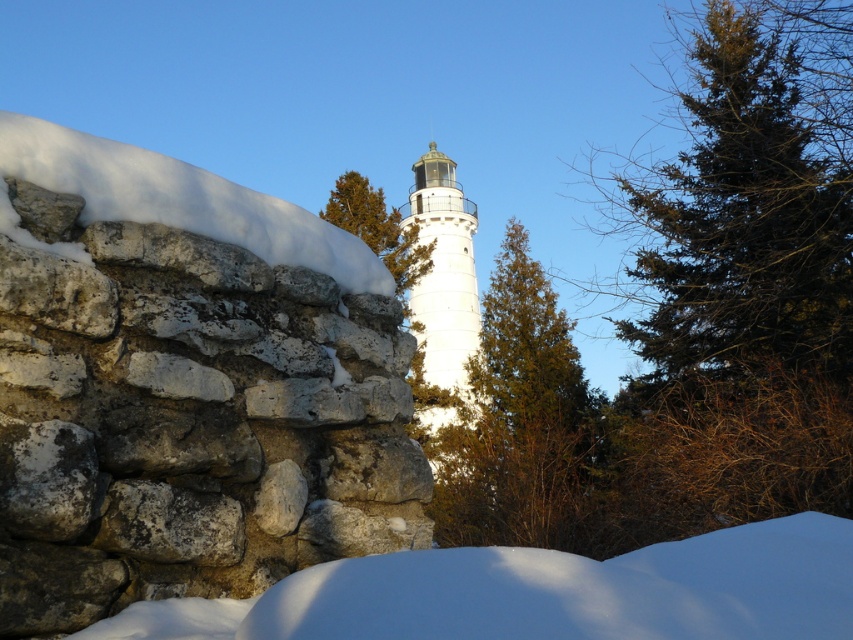
You are standing in the snowy landscape and want to take a photo of both the green textured tree at center and the white smooth tower at center. Which object should you focus on first to ensure both are in clear view?

You should focus on the green textured tree at center first because it is closer to you than the white smooth tower at center, ensuring both will be in clear view when focused properly.